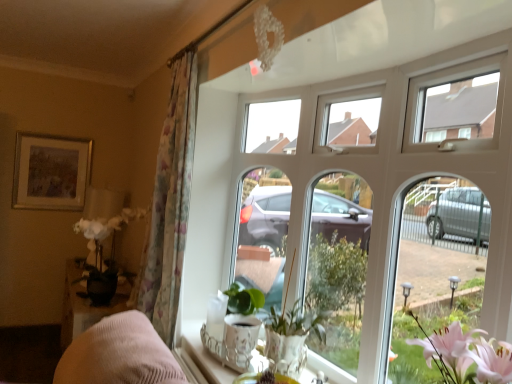
Question: Does translucent glass vase at lower center have a greater height compared to white ceramic tray at lower center?

Choices:
 (A) yes
 (B) no

Answer: (A)

Question: Does translucent glass vase at lower center have a smaller size compared to white ceramic tray at lower center?

Choices:
 (A) yes
 (B) no

Answer: (A)

Question: Does translucent glass vase at lower center appear on the right side of white ceramic tray at lower center?

Choices:
 (A) yes
 (B) no

Answer: (A)

Question: Can we say translucent glass vase at lower center lies outside white ceramic tray at lower center?

Choices:
 (A) yes
 (B) no

Answer: (B)

Question: Would you say translucent glass vase at lower center contains white ceramic tray at lower center?

Choices:
 (A) yes
 (B) no

Answer: (B)

Question: From a real-world perspective, is green matte plant at center physically located above or below white ceramic tray at lower center?

Choices:
 (A) below
 (B) above

Answer: (B)

Question: Based on their positions, is green matte plant at center located to the left or right of white ceramic tray at lower center?

Choices:
 (A) left
 (B) right

Answer: (B)

Question: Is green matte plant at center bigger or smaller than white ceramic tray at lower center?

Choices:
 (A) small
 (B) big

Answer: (B)

Question: Considering the positions of green matte plant at center and white ceramic tray at lower center in the image, is green matte plant at center taller or shorter than white ceramic tray at lower center?

Choices:
 (A) tall
 (B) short

Answer: (A)

Question: From the image's perspective, relative to gold-framed painting at upper left, is floral fabric curtain at left above or below?

Choices:
 (A) below
 (B) above

Answer: (A)

Question: Is point (168, 117) positioned closer to the camera than point (22, 152)?

Choices:
 (A) farther
 (B) closer

Answer: (B)

Question: In the image, is floral fabric curtain at left positioned in front of or behind gold-framed painting at upper left?

Choices:
 (A) behind
 (B) front

Answer: (B)

Question: Considering the positions of floral fabric curtain at left and gold-framed painting at upper left in the image, is floral fabric curtain at left taller or shorter than gold-framed painting at upper left?

Choices:
 (A) tall
 (B) short

Answer: (A)

Question: Is floral fabric curtain at left to the left or to the right of translucent glass vase at lower center in the image?

Choices:
 (A) right
 (B) left

Answer: (B)

Question: In the image, is floral fabric curtain at left positioned in front of or behind translucent glass vase at lower center?

Choices:
 (A) behind
 (B) front

Answer: (A)